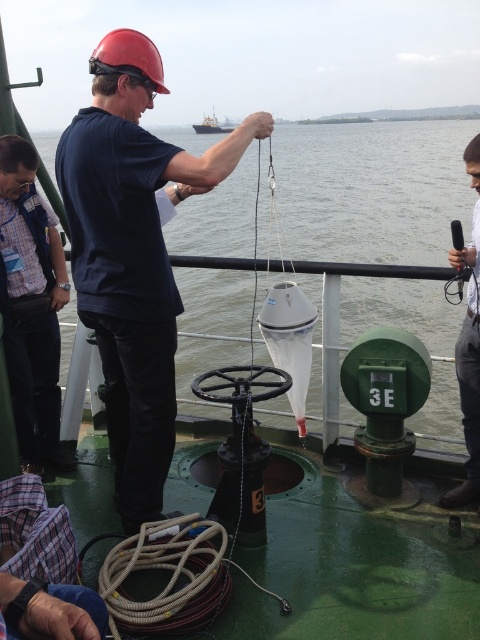
You are a researcher on the ship and need to place a label on the transparent plastic bag at center. What are the coordinates where you should place the label?

The coordinates for the transparent plastic bag at center are at point (372, 189).

You are a crew member on the ship and need to store a new sample in the transparent plastic bag at center. However, you are wearing a gray fabric shirt at right. Will your shirt interfere with placing the sample into the bag?

The transparent plastic bag at center has a larger width than the gray fabric shirt at right, so the shirt should not interfere with placing the sample into the bag.